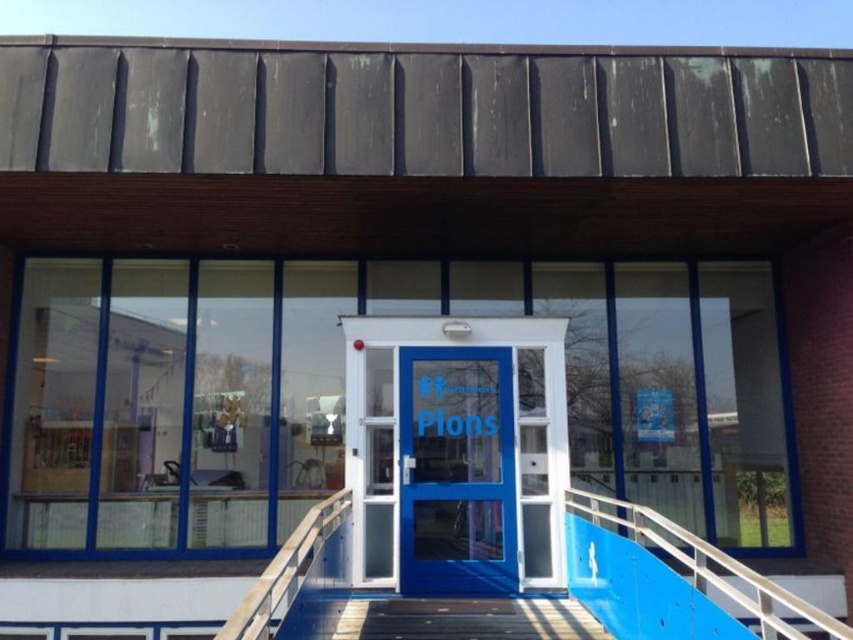
You are a delivery person trying to load a package onto a cart. The cart is currently positioned at the entrance of the building. You need to know if the blue glossy door at center is taller than the white plastic rail at center to determine if the cart can pass through without hitting anything. Can you confirm which one is taller?

The blue glossy door at center is much taller than the white plastic rail at center, so the cart may need to adjust its height or path to avoid hitting the door.

You are a delivery person with a large box that is 1 meter wide. You need to enter the building through the entrance shown in the image. Can you fit through the blue glossy door at center while carrying the box? Please consider the width of the blue metallic handrail at lower right in your answer.

The blue glossy door at center might be wider than blue metallic handrail at lower right. Since the box is 1 meter wide, if the door is wider than the handrail, it should accommodate the box provided the handrail doesn

You are a delivery person with a cart that is 3 feet wide. You need to move from the blue glossy door at center to the white plastic rail at center. Can your cart fit through the space between them?

The distance between the blue glossy door at center and the white plastic rail at center is 7.07 feet, so yes, the cart can fit through the space since it is wider than the cart.